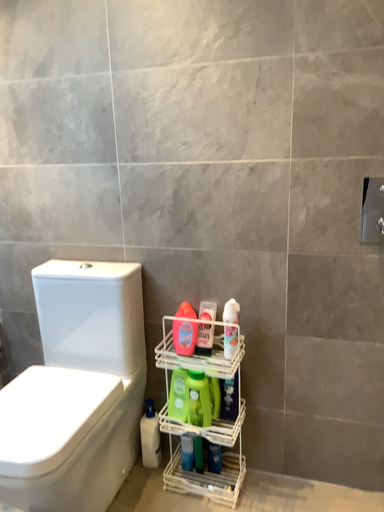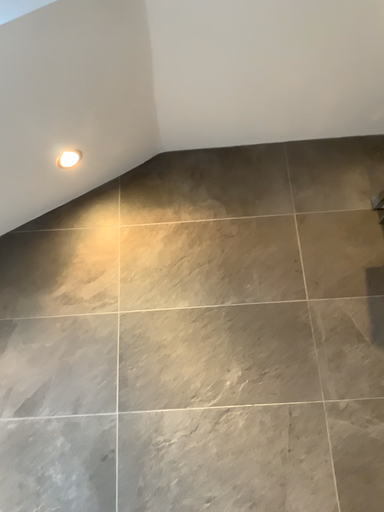
Question: Which way did the camera rotate in the video?

Choices:
 (A) rotated upward
 (B) rotated downward

Answer: (A)